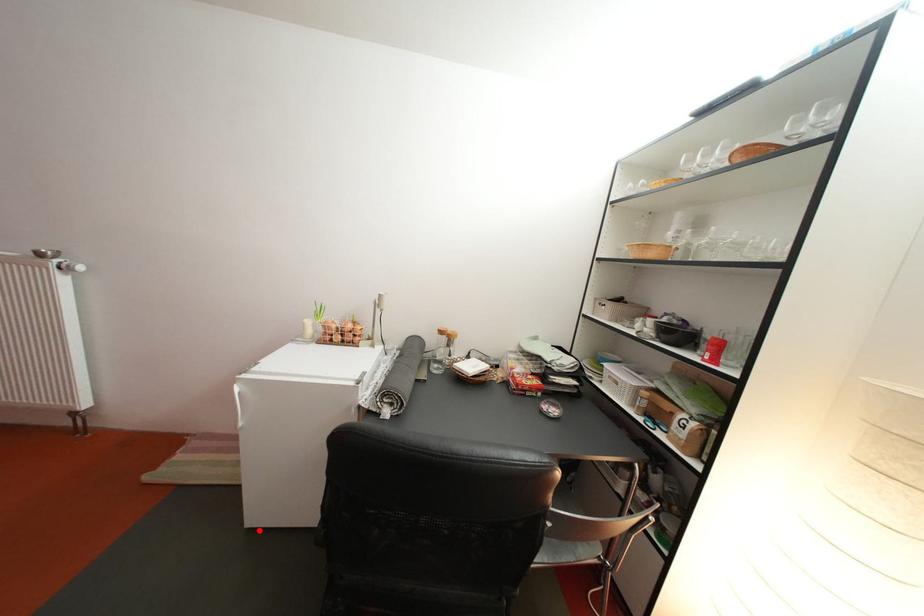
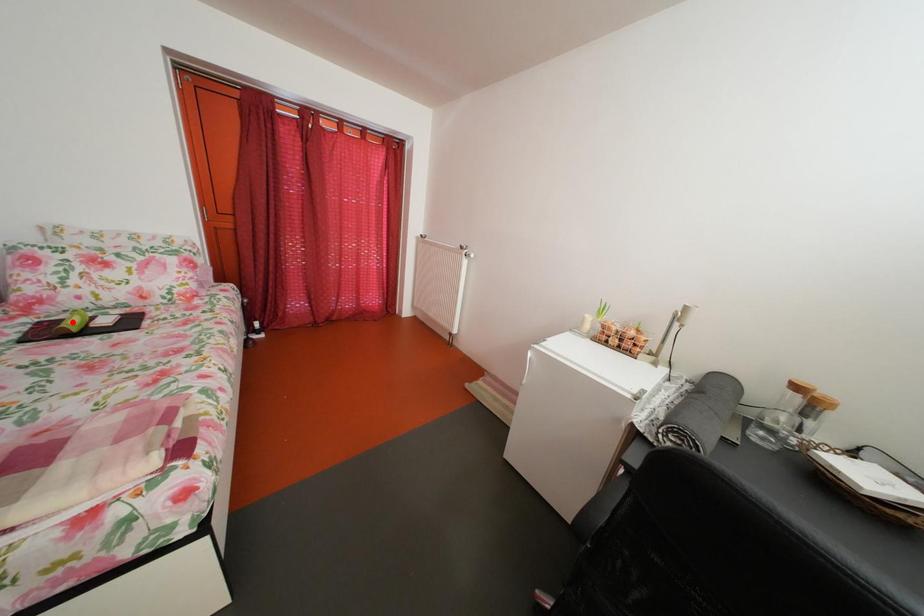
I am providing you with two images of the same scene from different viewpoints. A red point is marked on the first image and another point is marked on the second image. Is the marked point in image1 the same physical position as the marked point in image2?

No